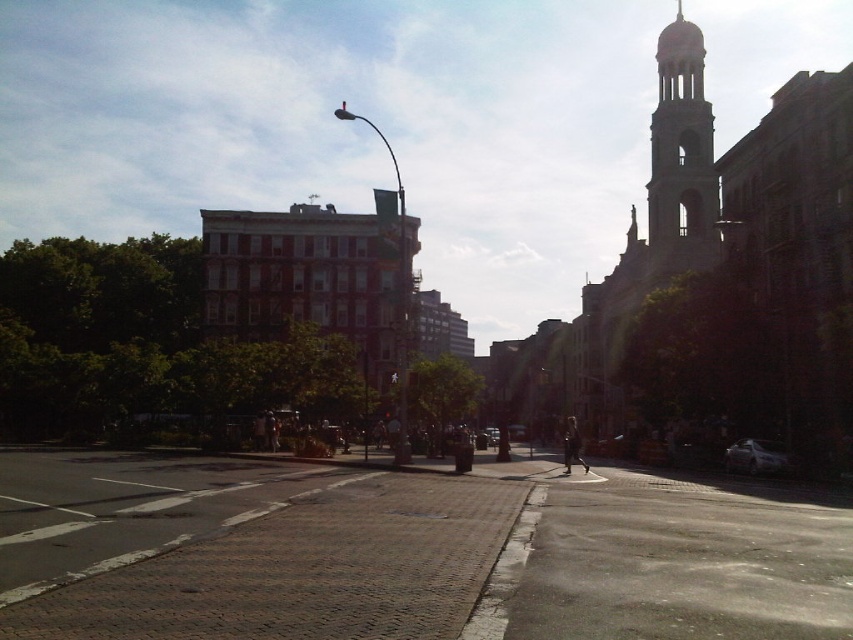
Who is taller, gray stone tower at upper right or metallic silver car at center?

With more height is gray stone tower at upper right.

Does point (650, 161) lie behind point (489, 444)?

That is True.

Consider the image. Who is more forward, [701,77] or [490,429]?

Point [701,77] is in front.

Locate an element on the screen. The height and width of the screenshot is (640, 853). gray stone tower at upper right is located at coordinates (682, 156).

Based on the photo, does satin silver sedan at lower right have a lesser height compared to metallic silver car at center?

Indeed, satin silver sedan at lower right has a lesser height compared to metallic silver car at center.

Does satin silver sedan at lower right lie behind metallic silver car at center?

No, satin silver sedan at lower right is closer to the viewer.

Does point (759, 442) come in front of point (491, 435)?

That is True.

Locate an element on the screen. This screenshot has width=853, height=640. satin silver sedan at lower right is located at coordinates (756, 456).

Does gray stone tower at upper right appear on the right side of satin silver sedan at lower right?

Correct, you'll find gray stone tower at upper right to the right of satin silver sedan at lower right.

Is point (666, 72) closer to camera compared to point (729, 460)?

No, it is behind (729, 460).

You are a GUI agent. You are given a task and a screenshot of the screen. Output one action in this format:
    pyautogui.click(x=<x>, y=<y>)
    Task: Click on the gray stone tower at upper right
    The image size is (853, 640).
    Given the screenshot: What is the action you would take?
    pyautogui.click(x=682, y=156)

The image size is (853, 640). I want to click on gray stone tower at upper right, so click(682, 156).